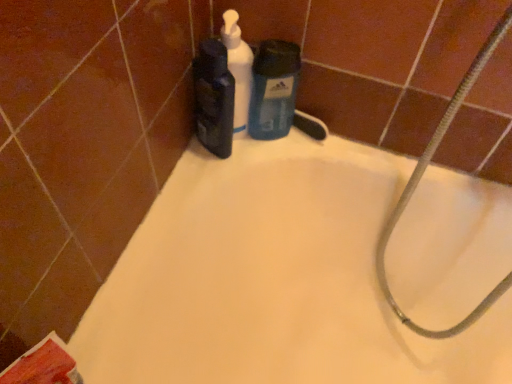
Where is `vacant space in front of matte black bottle at upper center, the third cleaning product in the right-to-left sequence`? This screenshot has height=384, width=512. vacant space in front of matte black bottle at upper center, the third cleaning product in the right-to-left sequence is located at coordinates (175, 205).